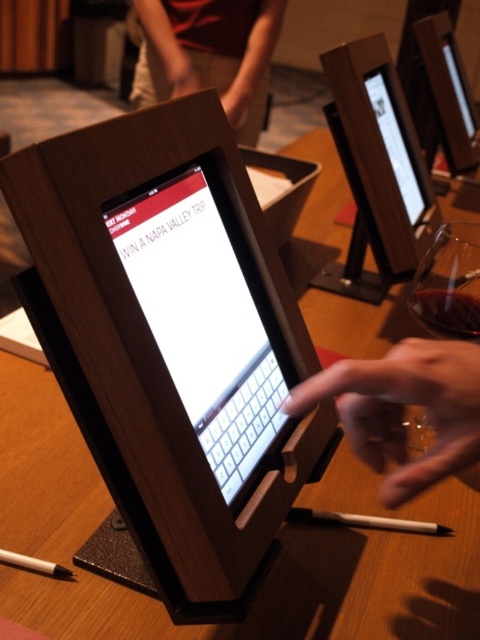
Question: Does flesh-toned skin at center have a greater width compared to transparent glass at right?

Choices:
 (A) yes
 (B) no

Answer: (A)

Question: Which of the following is the closest to the observer?

Choices:
 (A) (476, 392)
 (B) (45, 563)
 (C) (447, 259)
 (D) (479, 307)

Answer: (A)

Question: Is matte black tablet at center bigger than white plastic pen at lower center?

Choices:
 (A) no
 (B) yes

Answer: (B)

Question: Can you confirm if brown fabric shirt at upper center is thinner than white matte pencil at lower left?

Choices:
 (A) no
 (B) yes

Answer: (A)

Question: Based on their relative distances, which object is farther from the transparent glass at center?

Choices:
 (A) white plastic pen at lower center
 (B) flesh-toned skin at center
 (C) matte black tablet at center

Answer: (B)

Question: Which point is closer to the camera?

Choices:
 (A) matte black tablet at center
 (B) matte black screen at center
 (C) brown fabric shirt at upper center
 (D) white matte pencil at lower left

Answer: (A)